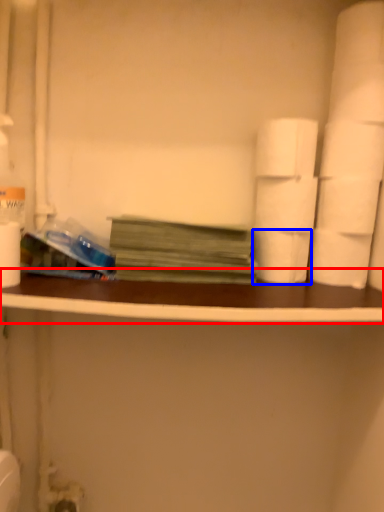
Question: Which of the following is the closest to the observer, ledge (highlighted by a red box) or toilet paper (highlighted by a blue box)?

Choices:
 (A) ledge
 (B) toilet paper

Answer: (A)